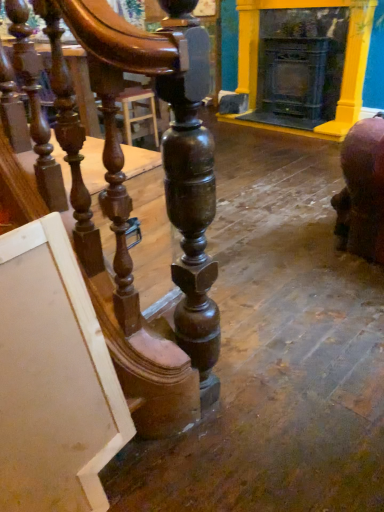
What do you see at coordinates (344, 60) in the screenshot?
I see `matte black fireplace at upper right` at bounding box center [344, 60].

The image size is (384, 512). I want to click on matte black fireplace at upper right, so click(344, 60).

What do you see at coordinates (142, 174) in the screenshot? Image resolution: width=384 pixels, height=512 pixels. I see `polished wood table at left` at bounding box center [142, 174].

Find the location of `polished wood table at left`. polished wood table at left is located at coordinates (142, 174).

Locate an element on the screen. This screenshot has height=512, width=384. matte black fireplace at upper right is located at coordinates (344, 60).

Would you say matte black fireplace at upper right is to the left or to the right of polished wood table at left in the picture?

Based on their positions, matte black fireplace at upper right is located to the right of polished wood table at left.

Which object is further away from the camera, matte black fireplace at upper right or polished wood table at left?

Positioned behind is matte black fireplace at upper right.

Considering the positions of point (340, 135) and point (140, 186), is point (340, 135) closer or farther from the camera than point (140, 186)?

Point (340, 135) appears to be farther away from the viewer than point (140, 186).

From the image's perspective, is matte black fireplace at upper right located above or below polished wood table at left?

Clearly, from the image's perspective, matte black fireplace at upper right is above polished wood table at left.

From a real-world perspective, which is physically below, matte black fireplace at upper right or polished wood table at left?

In real-world perspective, polished wood table at left is lower.

Looking at their sizes, would you say matte black fireplace at upper right is wider or thinner than polished wood table at left?

In the image, matte black fireplace at upper right appears to be more narrow than polished wood table at left.

Based on the photo, considering the sizes of objects matte black fireplace at upper right and polished wood table at left in the image provided, who is taller, matte black fireplace at upper right or polished wood table at left?

With more height is matte black fireplace at upper right.

Considering the relative sizes of matte black fireplace at upper right and polished wood table at left in the image provided, is matte black fireplace at upper right bigger than polished wood table at left?

No.

Is matte black fireplace at upper right not inside polished wood table at left?

Yes.

Are matte black fireplace at upper right and polished wood table at left located far from each other?

Yes, matte black fireplace at upper right and polished wood table at left are quite far apart.

Is matte black fireplace at upper right positioned with its back to polished wood table at left?

No, matte black fireplace at upper right is not facing the opposite direction of polished wood table at left.

Can you tell me how much matte black fireplace at upper right and polished wood table at left differ in facing direction?

matte black fireplace at upper right and polished wood table at left are facing 175 degrees away from each other.

How far apart are matte black fireplace at upper right and polished wood table at left?

A distance of 2.68 meters exists between matte black fireplace at upper right and polished wood table at left.

The height and width of the screenshot is (512, 384). I want to click on table located below the matte black fireplace at upper right (from the image's perspective), so click(142, 174).

Which is more to the right, polished wood table at left or matte black fireplace at upper right?

matte black fireplace at upper right is more to the right.

Considering the positions of objects polished wood table at left and matte black fireplace at upper right in the image provided, who is in front, polished wood table at left or matte black fireplace at upper right?

Positioned in front is polished wood table at left.

Which is in front, point (134, 170) or point (246, 30)?

The point (134, 170) is in front.

From the image's perspective, between polished wood table at left and matte black fireplace at upper right, who is located below?

From the image's view, polished wood table at left is below.

From a real-world perspective, who is located higher, polished wood table at left or matte black fireplace at upper right?

matte black fireplace at upper right.

Considering the relative sizes of polished wood table at left and matte black fireplace at upper right in the image provided, is polished wood table at left wider than matte black fireplace at upper right?

Yes, polished wood table at left is wider than matte black fireplace at upper right.

Considering the sizes of polished wood table at left and matte black fireplace at upper right in the image, is polished wood table at left taller or shorter than matte black fireplace at upper right?

polished wood table at left is shorter than matte black fireplace at upper right.

Does polished wood table at left have a larger size compared to matte black fireplace at upper right?

Yes, polished wood table at left is bigger than matte black fireplace at upper right.

Is polished wood table at left positioned beyond the bounds of matte black fireplace at upper right?

polished wood table at left is positioned outside matte black fireplace at upper right.

Is polished wood table at left directly adjacent to matte black fireplace at upper right?

No, polished wood table at left is not with matte black fireplace at upper right.

Is polished wood table at left oriented away from matte black fireplace at upper right?

That's not correct — polished wood table at left is not looking away from matte black fireplace at upper right.

Can you tell me how much polished wood table at left and matte black fireplace at upper right differ in facing direction?

There is a 175-degree angle between the facing directions of polished wood table at left and matte black fireplace at upper right.

You are a GUI agent. You are given a task and a screenshot of the screen. Output one action in this format:
    pyautogui.click(x=<x>, y=<y>)
    Task: Click on the fireplace above the polished wood table at left (from a real-world perspective)
    The height and width of the screenshot is (512, 384).
    Given the screenshot: What is the action you would take?
    pyautogui.click(x=344, y=60)

Image resolution: width=384 pixels, height=512 pixels. I want to click on table to the left of matte black fireplace at upper right, so click(142, 174).

You are a GUI agent. You are given a task and a screenshot of the screen. Output one action in this format:
    pyautogui.click(x=<x>, y=<y>)
    Task: Click on the fireplace on the right of the polished wood table at left
    
    Given the screenshot: What is the action you would take?
    pyautogui.click(x=344, y=60)